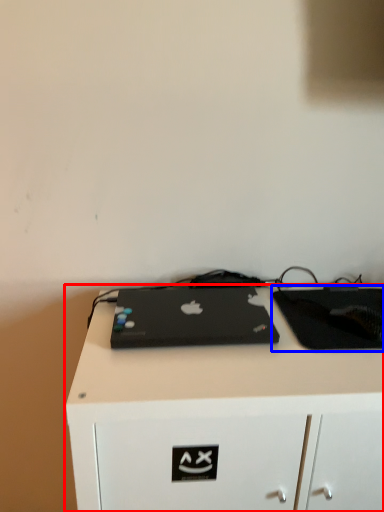
Question: Which object appears farthest to the camera in this image, desk (highlighted by a red box) or tablet computer (highlighted by a blue box)?

Choices:
 (A) desk
 (B) tablet computer

Answer: (B)